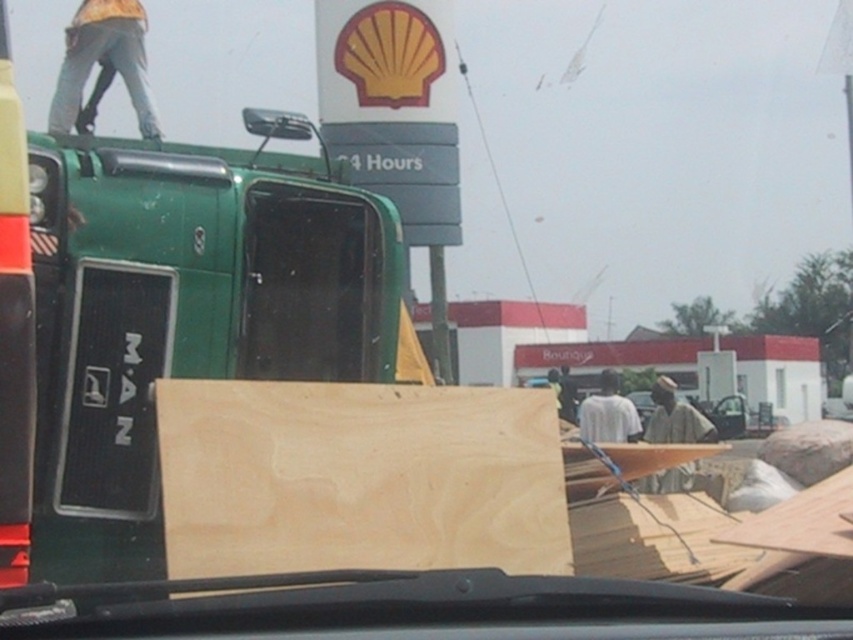
Question: Which point is farther to the camera?

Choices:
 (A) (370, 349)
 (B) (552, 428)
 (C) (631, 429)

Answer: (C)

Question: Can you confirm if transparent glass windshield at center is bigger than matte green truck at left?

Choices:
 (A) no
 (B) yes

Answer: (B)

Question: Estimate the real-world distances between objects in this image. Which object is closer to the transparent glass windshield at center?

Choices:
 (A) white matte shirt at center
 (B) matte green truck at left

Answer: (B)

Question: Can you confirm if light brown wood at center is bigger than jeans-clad figure at upper left?

Choices:
 (A) yes
 (B) no

Answer: (B)

Question: Is transparent glass windshield at center to the left of matte green truck at left from the viewer's perspective?

Choices:
 (A) no
 (B) yes

Answer: (A)

Question: Which point is closer to the camera?

Choices:
 (A) (7, 563)
 (B) (114, 8)
 (C) (614, 412)

Answer: (A)